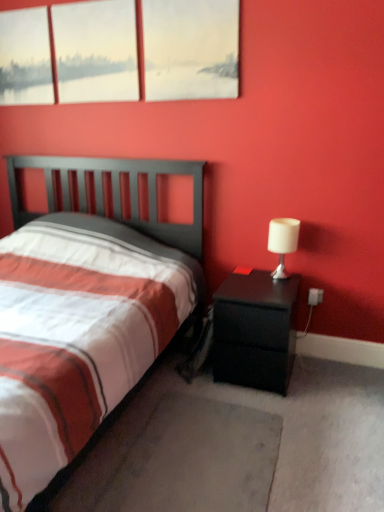
Question: Is black matte nightstand at right further to the viewer compared to matte white canvas at upper left, the third window viewed from the right?

Choices:
 (A) yes
 (B) no

Answer: (B)

Question: Is black matte nightstand at right positioned in front of matte white canvas at upper left, the 1th window viewed from the left?

Choices:
 (A) no
 (B) yes

Answer: (B)

Question: From a real-world perspective, is black matte nightstand at right positioned under matte white canvas at upper left, the third window viewed from the right, based on gravity?

Choices:
 (A) yes
 (B) no

Answer: (A)

Question: Would you say black matte nightstand at right contains matte white canvas at upper left, the 1th window viewed from the left?

Choices:
 (A) no
 (B) yes

Answer: (A)

Question: From the image's perspective, does black matte nightstand at right appear lower than matte white canvas at upper left, the third window viewed from the right?

Choices:
 (A) no
 (B) yes

Answer: (B)

Question: Is black matte nightstand at right facing towards matte white canvas at upper left, the 1th window viewed from the left?

Choices:
 (A) yes
 (B) no

Answer: (B)

Question: From a real-world perspective, is matte glass window at upper left, arranged as the second window when viewed from the right, physically above matte white painting at upper center, which is counted as the third window, starting from the left?

Choices:
 (A) yes
 (B) no

Answer: (A)

Question: Is matte glass window at upper left, arranged as the second window when viewed from the right, positioned with its back to matte white painting at upper center, which is counted as the third window, starting from the left?

Choices:
 (A) yes
 (B) no

Answer: (B)

Question: Are matte glass window at upper left, which is counted as the second window, starting from the left, and matte white painting at upper center, arranged as the first window when viewed from the right, beside each other?

Choices:
 (A) no
 (B) yes

Answer: (A)

Question: Does matte glass window at upper left, which is counted as the second window, starting from the left, have a lesser height compared to matte white painting at upper center, which is counted as the third window, starting from the left?

Choices:
 (A) no
 (B) yes

Answer: (A)

Question: Are matte glass window at upper left, which is counted as the second window, starting from the left, and matte white painting at upper center, arranged as the first window when viewed from the right, located far from each other?

Choices:
 (A) yes
 (B) no

Answer: (B)

Question: From the image's perspective, would you say matte glass window at upper left, which is counted as the second window, starting from the left, is shown under matte white painting at upper center, which is counted as the third window, starting from the left?

Choices:
 (A) yes
 (B) no

Answer: (B)

Question: From the image's perspective, is matte white painting at upper center, which is counted as the third window, starting from the left, under gray carpet at lower center?

Choices:
 (A) yes
 (B) no

Answer: (B)